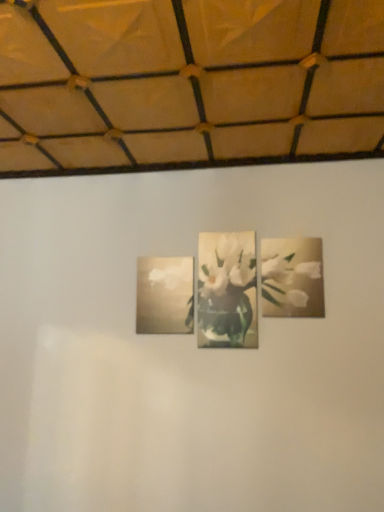
Question: Is matte gold picture frame at center far from white glossy flower at upper right?

Choices:
 (A) yes
 (B) no

Answer: (B)

Question: From the image's perspective, would you say matte gold picture frame at center is shown under white glossy flower at upper right?

Choices:
 (A) no
 (B) yes

Answer: (B)

Question: Is matte gold picture frame at center positioned beyond the bounds of white glossy flower at upper right?

Choices:
 (A) yes
 (B) no

Answer: (A)

Question: Is matte gold picture frame at center wider than white glossy flower at upper right?

Choices:
 (A) yes
 (B) no

Answer: (A)

Question: Is matte gold picture frame at center at the left side of white glossy flower at upper right?

Choices:
 (A) no
 (B) yes

Answer: (B)

Question: From the image's perspective, is matte gold picture frame at center on top of white glossy flower at upper right?

Choices:
 (A) no
 (B) yes

Answer: (A)

Question: Is white glossy flower at upper right wider than matte gold picture frame at center?

Choices:
 (A) no
 (B) yes

Answer: (A)

Question: From a real-world perspective, is white glossy flower at upper right positioned under matte gold picture frame at center based on gravity?

Choices:
 (A) no
 (B) yes

Answer: (A)

Question: Can you confirm if white glossy flower at upper right is taller than matte gold picture frame at center?

Choices:
 (A) yes
 (B) no

Answer: (A)

Question: Considering the relative sizes of white glossy flower at upper right and matte gold picture frame at center in the image provided, is white glossy flower at upper right bigger than matte gold picture frame at center?

Choices:
 (A) yes
 (B) no

Answer: (B)

Question: Considering the relative sizes of white glossy flower at upper right and matte gold picture frame at center in the image provided, is white glossy flower at upper right shorter than matte gold picture frame at center?

Choices:
 (A) yes
 (B) no

Answer: (B)

Question: From the image's perspective, is white glossy flower at upper right under matte gold picture frame at center?

Choices:
 (A) yes
 (B) no

Answer: (B)

Question: From the image's perspective, is white glossy flower at upper right positioned above or below matte gold picture frame at center?

Choices:
 (A) above
 (B) below

Answer: (A)